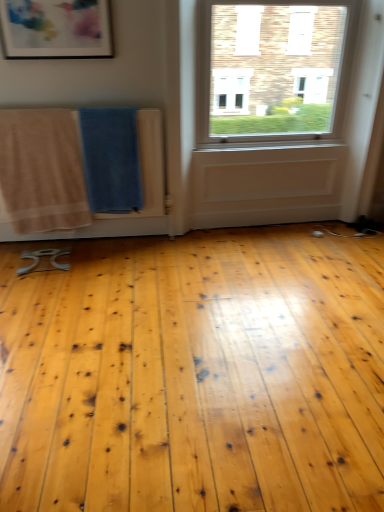
This screenshot has height=512, width=384. I want to click on matte plastic picture frame at upper left, so click(56, 29).

Image resolution: width=384 pixels, height=512 pixels. What do you see at coordinates (111, 160) in the screenshot? I see `blue textured towel at center, positioned as the first beach towel in right-to-left order` at bounding box center [111, 160].

The image size is (384, 512). Describe the element at coordinates (42, 170) in the screenshot. I see `beige cotton towel at left, which is the 1th beach towel in left-to-right order` at that location.

I want to click on matte plastic picture frame at upper left, so click(x=56, y=29).

Which is behind, point (48, 145) or point (74, 46)?

The point (48, 145) is farther.

In the scene shown: Which object is closer to the camera, beige cotton towel at left, which is the 2th beach towel in right-to-left order, or matte plastic picture frame at upper left?

matte plastic picture frame at upper left is more forward.

There is a matte plastic picture frame at upper left. Where is `the 2nd beach towel below it (from a real-world perspective)`? This screenshot has height=512, width=384. the 2nd beach towel below it (from a real-world perspective) is located at coordinates (42, 170).

Who is shorter, beige cotton towel at left, which is the 1th beach towel in left-to-right order, or matte plastic picture frame at upper left?

matte plastic picture frame at upper left.

Could you tell me if beige cotton towel at left, which is the 1th beach towel in left-to-right order, is facing blue textured towel at center, positioned as the first beach towel in right-to-left order?

No, beige cotton towel at left, which is the 1th beach towel in left-to-right order, is not turned towards blue textured towel at center, positioned as the first beach towel in right-to-left order.

Which object is closer to the camera taking this photo, beige cotton towel at left, which is the 2th beach towel in right-to-left order, or blue textured towel at center, the 2th beach towel when ordered from left to right?

beige cotton towel at left, which is the 2th beach towel in right-to-left order, is in front.

Identify the location of beach towel lying in front of the blue textured towel at center, positioned as the first beach towel in right-to-left order. This screenshot has height=512, width=384. (42, 170).

Considering the relative positions of matte plastic picture frame at upper left and blue textured towel at center, the 2th beach towel when ordered from left to right, in the image provided, is matte plastic picture frame at upper left to the left or to the right of blue textured towel at center, the 2th beach towel when ordered from left to right,?

Based on their positions, matte plastic picture frame at upper left is located to the left of blue textured towel at center, the 2th beach towel when ordered from left to right.

Which is behind, matte plastic picture frame at upper left or blue textured towel at center, positioned as the first beach towel in right-to-left order?

blue textured towel at center, positioned as the first beach towel in right-to-left order.

Which of these two, matte plastic picture frame at upper left or blue textured towel at center, the 2th beach towel when ordered from left to right, is wider?

blue textured towel at center, the 2th beach towel when ordered from left to right.

Who is taller, matte plastic picture frame at upper left or blue textured towel at center, the 2th beach towel when ordered from left to right?

Standing taller between the two is blue textured towel at center, the 2th beach towel when ordered from left to right.

Does blue textured towel at center, positioned as the first beach towel in right-to-left order, have a lesser width compared to beige cotton towel at left, which is the 2th beach towel in right-to-left order?

No, blue textured towel at center, positioned as the first beach towel in right-to-left order, is not thinner than beige cotton towel at left, which is the 2th beach towel in right-to-left order.

Consider the image. Is blue textured towel at center, the 2th beach towel when ordered from left to right, far from beige cotton towel at left, which is the 2th beach towel in right-to-left order?

No, there isn't a large distance between blue textured towel at center, the 2th beach towel when ordered from left to right, and beige cotton towel at left, which is the 2th beach towel in right-to-left order.

Could you tell me if blue textured towel at center, the 2th beach towel when ordered from left to right, is turned towards beige cotton towel at left, which is the 2th beach towel in right-to-left order?

No, blue textured towel at center, the 2th beach towel when ordered from left to right, is not turned towards beige cotton towel at left, which is the 2th beach towel in right-to-left order.

Based on the photo, from a real-world perspective, is matte plastic picture frame at upper left physically located above or below beige cotton towel at left, which is the 1th beach towel in left-to-right order?

From a real-world perspective, matte plastic picture frame at upper left is physically above beige cotton towel at left, which is the 1th beach towel in left-to-right order.

Looking at this image, is matte plastic picture frame at upper left wider or thinner than beige cotton towel at left, which is the 2th beach towel in right-to-left order?

Considering their sizes, matte plastic picture frame at upper left looks slimmer than beige cotton towel at left, which is the 2th beach towel in right-to-left order.

Does matte plastic picture frame at upper left have a lesser height compared to beige cotton towel at left, which is the 1th beach towel in left-to-right order?

Correct, matte plastic picture frame at upper left is not as tall as beige cotton towel at left, which is the 1th beach towel in left-to-right order.

Is matte plastic picture frame at upper left positioned before beige cotton towel at left, which is the 1th beach towel in left-to-right order?

Yes, it is in front of beige cotton towel at left, which is the 1th beach towel in left-to-right order.

From the image's perspective, is blue textured towel at center, the 2th beach towel when ordered from left to right, positioned above or below matte plastic picture frame at upper left?

blue textured towel at center, the 2th beach towel when ordered from left to right, is below matte plastic picture frame at upper left.

From a real-world perspective, who is located higher, blue textured towel at center, the 2th beach towel when ordered from left to right, or matte plastic picture frame at upper left?

matte plastic picture frame at upper left.

In the scene shown: Between blue textured towel at center, positioned as the first beach towel in right-to-left order, and matte plastic picture frame at upper left, which one has larger width?

With larger width is blue textured towel at center, positioned as the first beach towel in right-to-left order.

Is blue textured towel at center, positioned as the first beach towel in right-to-left order, positioned before matte plastic picture frame at upper left?

No, blue textured towel at center, positioned as the first beach towel in right-to-left order, is further to the viewer.

You are a GUI agent. You are given a task and a screenshot of the screen. Output one action in this format:
    pyautogui.click(x=<x>, y=<y>)
    Task: Click on the 2nd beach towel positioned below the matte plastic picture frame at upper left (from the image's perspective)
    The width and height of the screenshot is (384, 512).
    Given the screenshot: What is the action you would take?
    pyautogui.click(x=42, y=170)

You are a GUI agent. You are given a task and a screenshot of the screen. Output one action in this format:
    pyautogui.click(x=<x>, y=<y>)
    Task: Click on the beach towel lying behind the beige cotton towel at left, which is the 1th beach towel in left-to-right order
    
    Given the screenshot: What is the action you would take?
    pyautogui.click(x=111, y=160)

Based on their spatial positions, is matte plastic picture frame at upper left or blue textured towel at center, the 2th beach towel when ordered from left to right, further from beige cotton towel at left, which is the 2th beach towel in right-to-left order?

Based on the image, matte plastic picture frame at upper left appears to be further to beige cotton towel at left, which is the 2th beach towel in right-to-left order.

Estimate the real-world distances between objects in this image. Which object is further from blue textured towel at center, positioned as the first beach towel in right-to-left order, matte plastic picture frame at upper left or beige cotton towel at left, which is the 1th beach towel in left-to-right order?

matte plastic picture frame at upper left lies further to blue textured towel at center, positioned as the first beach towel in right-to-left order, than the other object.

Which object lies further to the anchor point blue textured towel at center, the 2th beach towel when ordered from left to right, beige cotton towel at left, which is the 1th beach towel in left-to-right order, or matte plastic picture frame at upper left?

The object further to blue textured towel at center, the 2th beach towel when ordered from left to right, is matte plastic picture frame at upper left.

From the image, which object appears to be nearer to beige cotton towel at left, which is the 1th beach towel in left-to-right order, blue textured towel at center, positioned as the first beach towel in right-to-left order, or matte plastic picture frame at upper left?

blue textured towel at center, positioned as the first beach towel in right-to-left order, lies closer to beige cotton towel at left, which is the 1th beach towel in left-to-right order, than the other object.

Based on their spatial positions, is beige cotton towel at left, which is the 1th beach towel in left-to-right order, or blue textured towel at center, positioned as the first beach towel in right-to-left order, closer to matte plastic picture frame at upper left?

Based on the image, blue textured towel at center, positioned as the first beach towel in right-to-left order, appears to be nearer to matte plastic picture frame at upper left.

Which object lies further to the anchor point matte plastic picture frame at upper left, blue textured towel at center, the 2th beach towel when ordered from left to right, or beige cotton towel at left, which is the 1th beach towel in left-to-right order?

The object further to matte plastic picture frame at upper left is beige cotton towel at left, which is the 1th beach towel in left-to-right order.

Locate an element on the screen. beach towel between matte plastic picture frame at upper left and beige cotton towel at left, which is the 2th beach towel in right-to-left order, in the up-down direction is located at coordinates (111, 160).